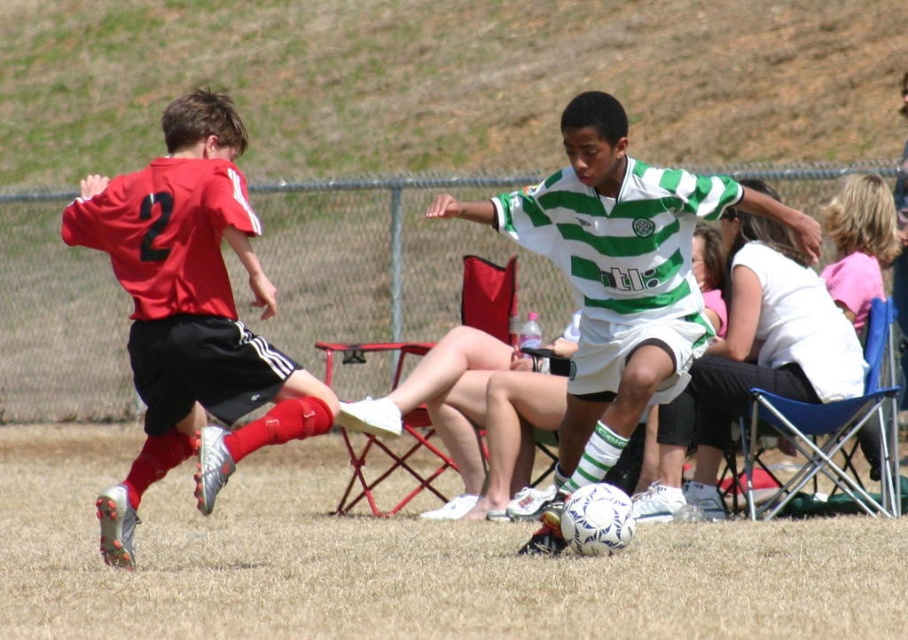
Is white matte soccer ball at center above matte red jersey at left?

Correct, white matte soccer ball at center is located above matte red jersey at left.

Does point (87, 205) come farther from viewer compared to point (257, 276)?

Yes, point (87, 205) is farther from viewer.

Does point (608, 452) lie in front of point (164, 170)?

No, (608, 452) is behind (164, 170).

The height and width of the screenshot is (640, 908). What are the coordinates of `white matte soccer ball at center` in the screenshot? It's located at (191, 316).

Is point (652, 381) positioned behind point (676, 378)?

That is False.

Between white matte soccer ball at center and green striped jersey at center, which one appears on the left side from the viewer's perspective?

green striped jersey at center is more to the left.

This screenshot has height=640, width=908. What do you see at coordinates (191, 316) in the screenshot?
I see `white matte soccer ball at center` at bounding box center [191, 316].

Find the location of `white matte soccer ball at center`. white matte soccer ball at center is located at coordinates (191, 316).

Does matte red jersey at left appear over green striped jersey at center?

No.

Can you confirm if matte red jersey at left is shorter than green striped jersey at center?

In fact, matte red jersey at left may be taller than green striped jersey at center.

Which is behind, point (130, 515) or point (571, 148)?

The point (571, 148) is behind.

What are the coordinates of `matte red jersey at left` in the screenshot? It's located at (190, 312).